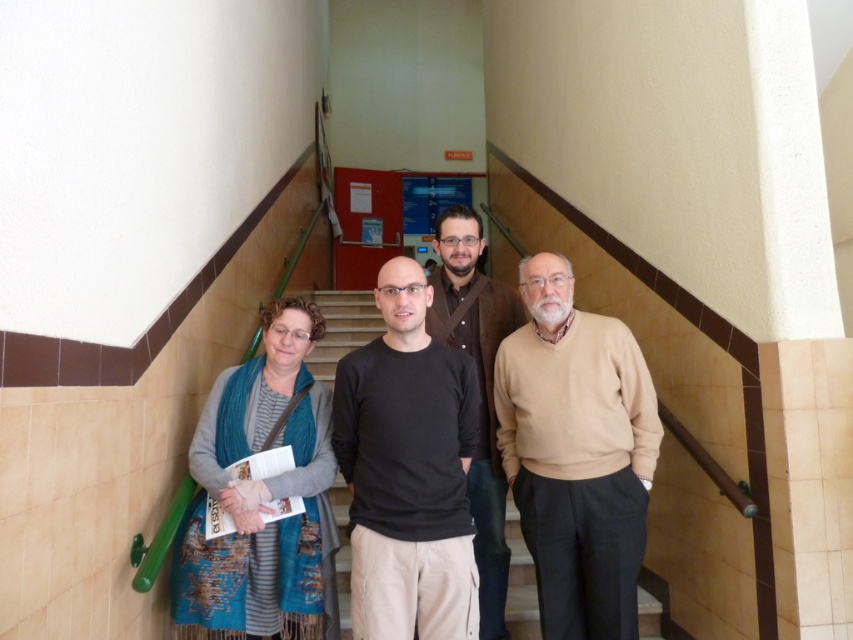
Question: Which point is closer to the camera taking this photo?

Choices:
 (A) (451, 561)
 (B) (241, 428)
 (C) (456, 305)

Answer: (A)

Question: Does beige sweater at center have a larger size compared to blue textured scarf at left?

Choices:
 (A) no
 (B) yes

Answer: (B)

Question: Is blue textured scarf at left further to the viewer compared to brown textured jacket at center?

Choices:
 (A) no
 (B) yes

Answer: (A)

Question: Which is nearer to the beige sweater at center?

Choices:
 (A) blue textured scarf at left
 (B) brown textured jacket at center

Answer: (B)

Question: Among these objects, which one is nearest to the camera?

Choices:
 (A) black matte shirt at center
 (B) brown textured jacket at center

Answer: (A)

Question: Is beige sweater at center to the left of brown textured jacket at center from the viewer's perspective?

Choices:
 (A) no
 (B) yes

Answer: (A)